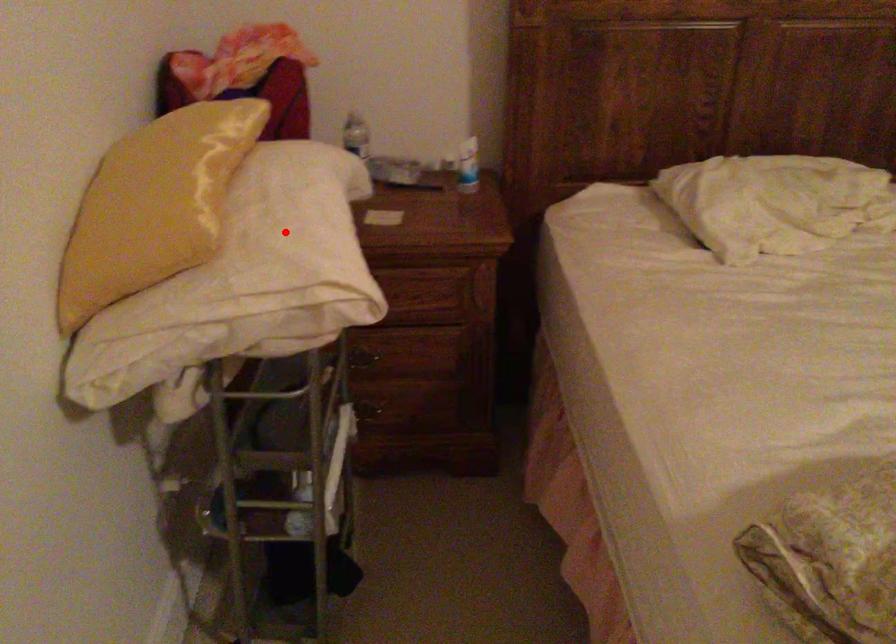
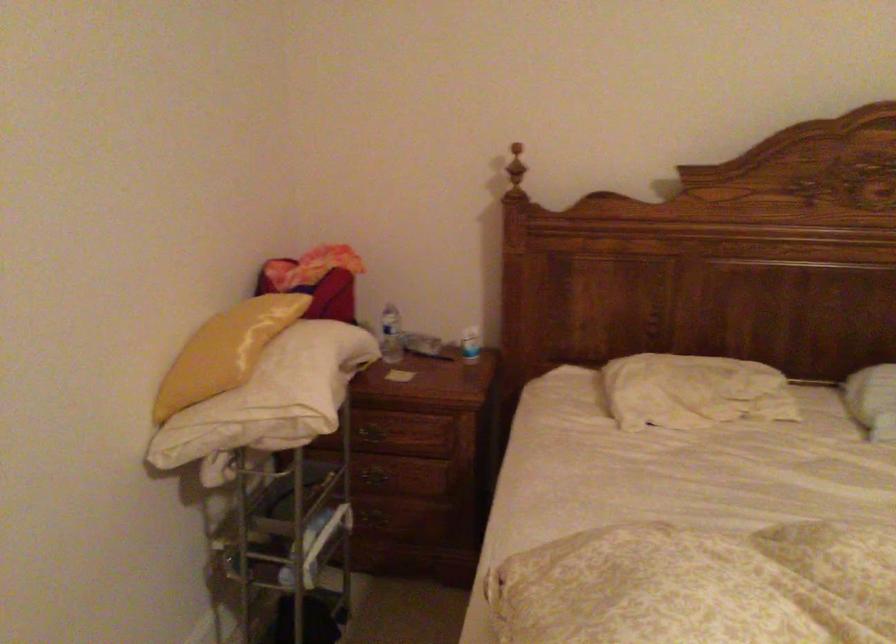
In the second image, find the point that corresponds to the highlighted location in the first image.

(287, 375)